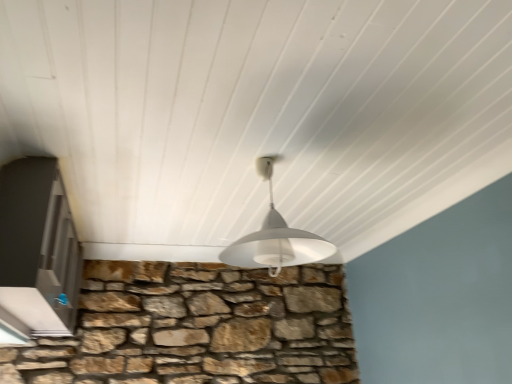
Question: Could you tell me if white glossy door at left is facing white matte lampshade at center?

Choices:
 (A) no
 (B) yes

Answer: (B)

Question: Is white glossy door at left thinner than white matte lampshade at center?

Choices:
 (A) yes
 (B) no

Answer: (A)

Question: Considering the relative positions of white glossy door at left and white matte lampshade at center in the image provided, is white glossy door at left to the left of white matte lampshade at center from the viewer's perspective?

Choices:
 (A) yes
 (B) no

Answer: (A)

Question: Does white glossy door at left lie in front of white matte lampshade at center?

Choices:
 (A) no
 (B) yes

Answer: (A)

Question: From the image's perspective, is white glossy door at left located above white matte lampshade at center?

Choices:
 (A) yes
 (B) no

Answer: (B)

Question: Considering the relative sizes of white glossy door at left and white matte lampshade at center in the image provided, is white glossy door at left wider than white matte lampshade at center?

Choices:
 (A) yes
 (B) no

Answer: (B)

Question: Considering the relative positions of white matte lampshade at center and white glossy door at left in the image provided, is white matte lampshade at center behind white glossy door at left?

Choices:
 (A) yes
 (B) no

Answer: (B)

Question: Considering the relative sizes of white matte lampshade at center and white glossy door at left in the image provided, is white matte lampshade at center taller than white glossy door at left?

Choices:
 (A) yes
 (B) no

Answer: (B)

Question: Is white glossy door at left completely or partially inside white matte lampshade at center?

Choices:
 (A) yes
 (B) no

Answer: (B)

Question: Considering the relative sizes of white matte lampshade at center and white glossy door at left in the image provided, is white matte lampshade at center smaller than white glossy door at left?

Choices:
 (A) no
 (B) yes

Answer: (B)

Question: From a real-world perspective, is white matte lampshade at center positioned under white glossy door at left based on gravity?

Choices:
 (A) yes
 (B) no

Answer: (B)

Question: Are white matte lampshade at center and white glossy door at left far apart?

Choices:
 (A) yes
 (B) no

Answer: (B)

Question: Considering the positions of point (297, 243) and point (31, 276), is point (297, 243) closer or farther from the camera than point (31, 276)?

Choices:
 (A) farther
 (B) closer

Answer: (A)